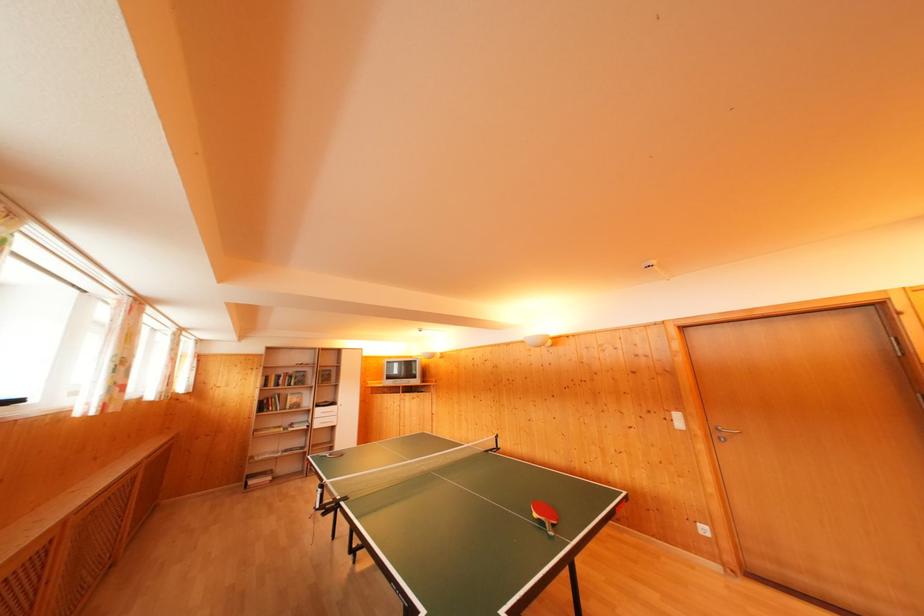
Which object does [544,515] point to?

It refers to a red ping pong paddle.